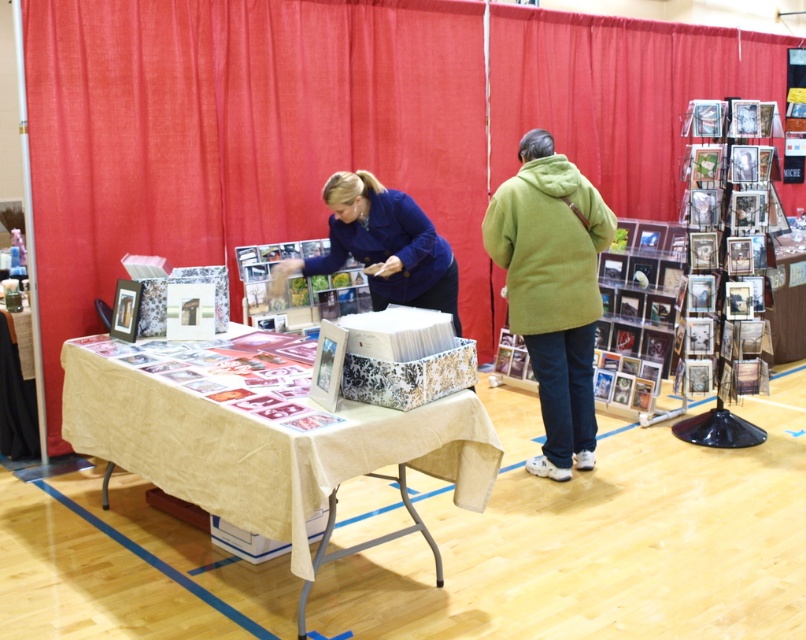
You are organizing an event and need to place a green fuzzy jacket at center and a blue fabric at center on a table. If the table has limited space, which item should you prioritize placing first to ensure both fit?

The green fuzzy jacket at center has a smaller width than the blue fabric at center, so you should place the blue fabric at center first to accommodate its larger size, ensuring both items fit on the table.